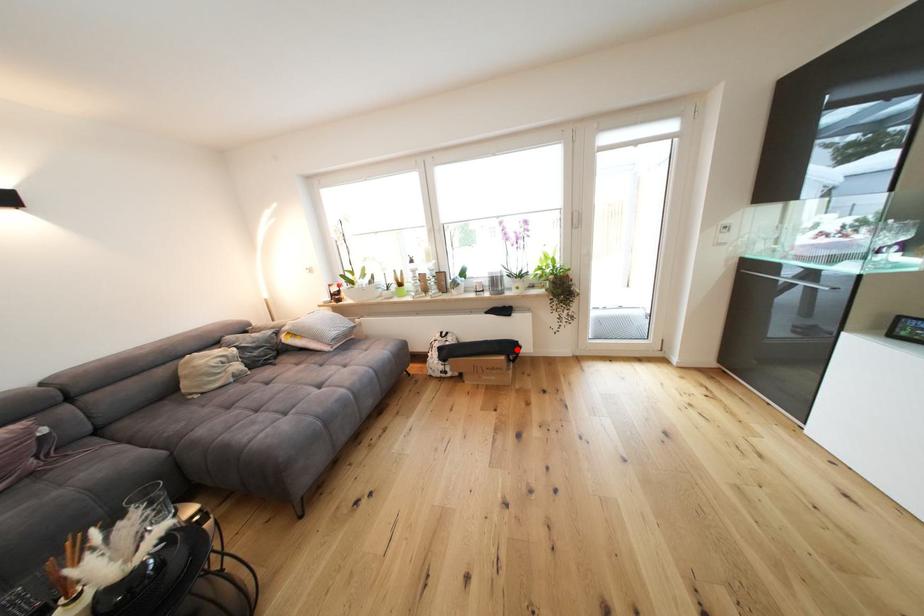
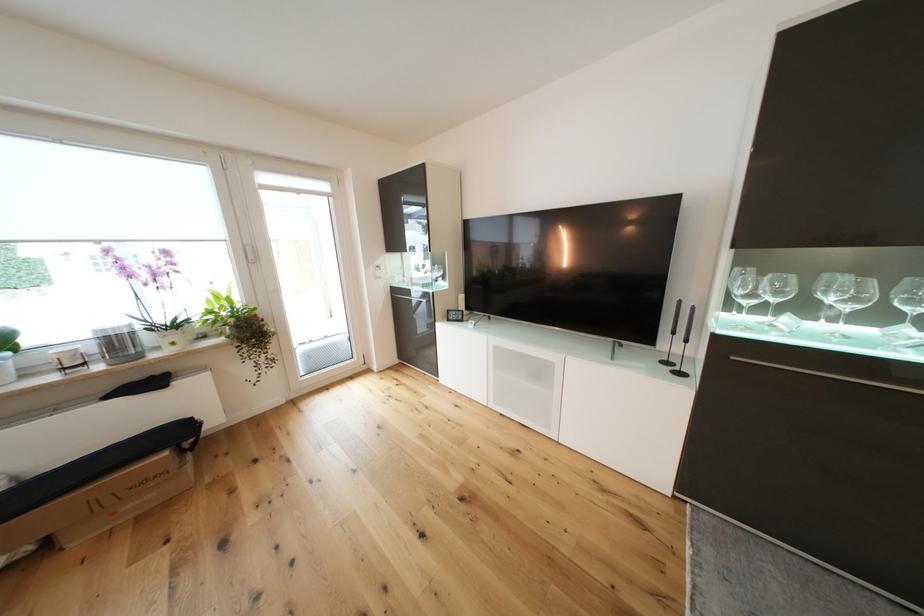
In the second image, find the point that corresponds to the highlighted location in the first image.

(186, 435)